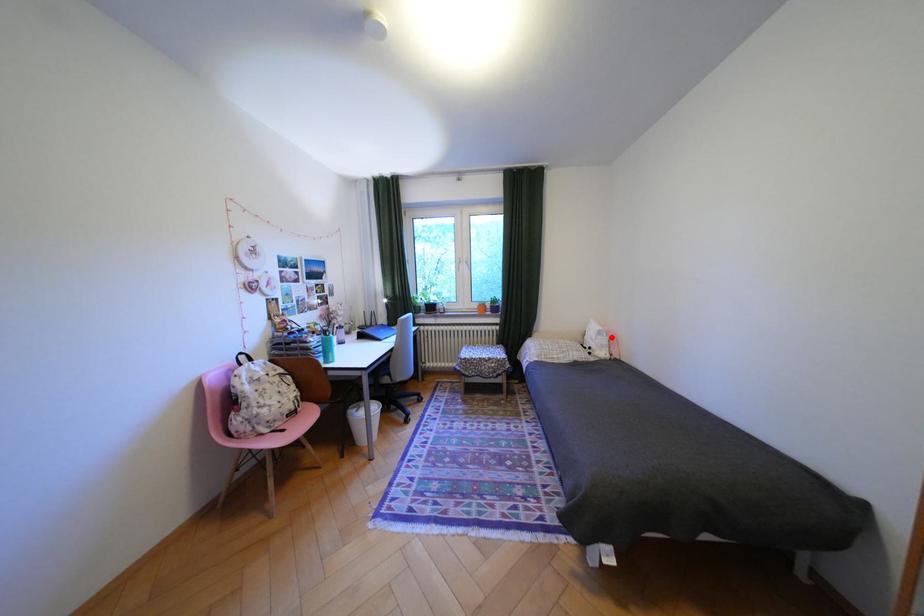
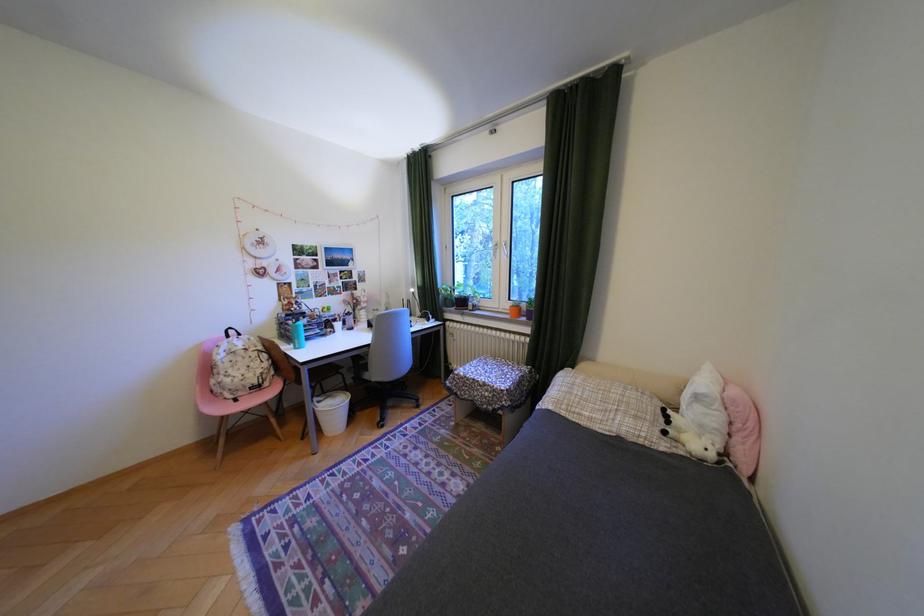
Question: I am providing you with two images of the same scene from different viewpoints. Image1 has a red point marked. In image2, the corresponding 3D location appears at what relative position? Reply with the corresponding letter.

Choices:
 (A) Closer
 (B) Farther

Answer: (B)